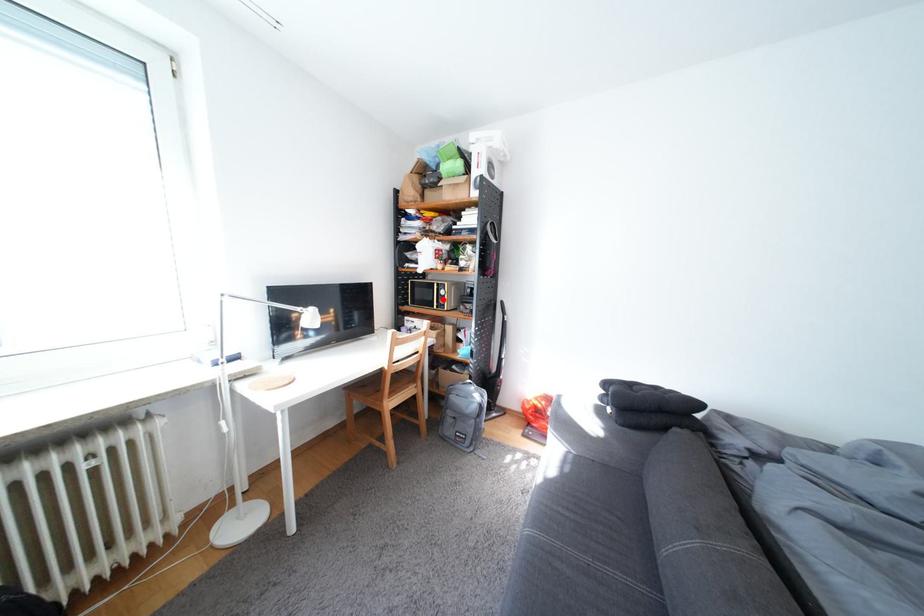
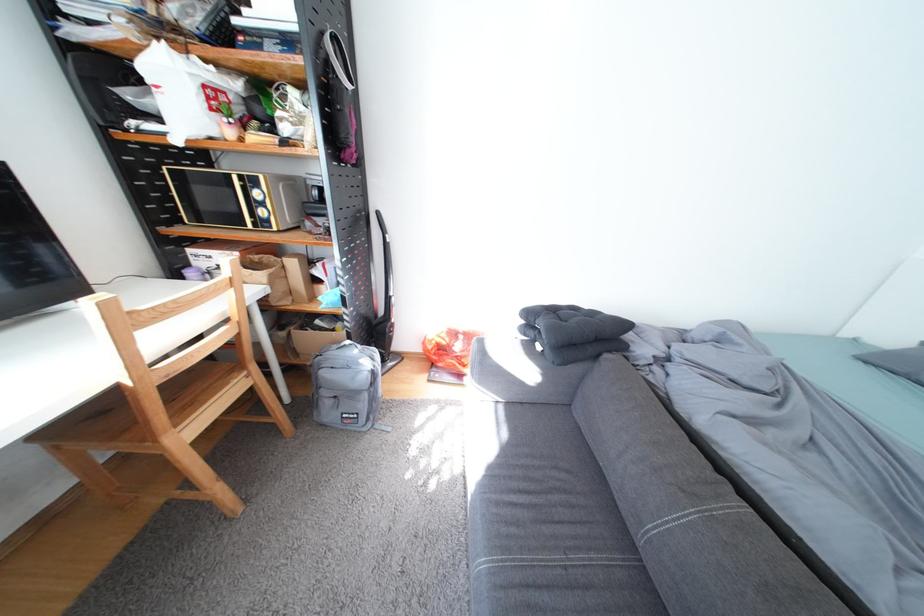
The point at the highlighted location is marked in the first image. Where is the corresponding point in the second image?

(246, 209)